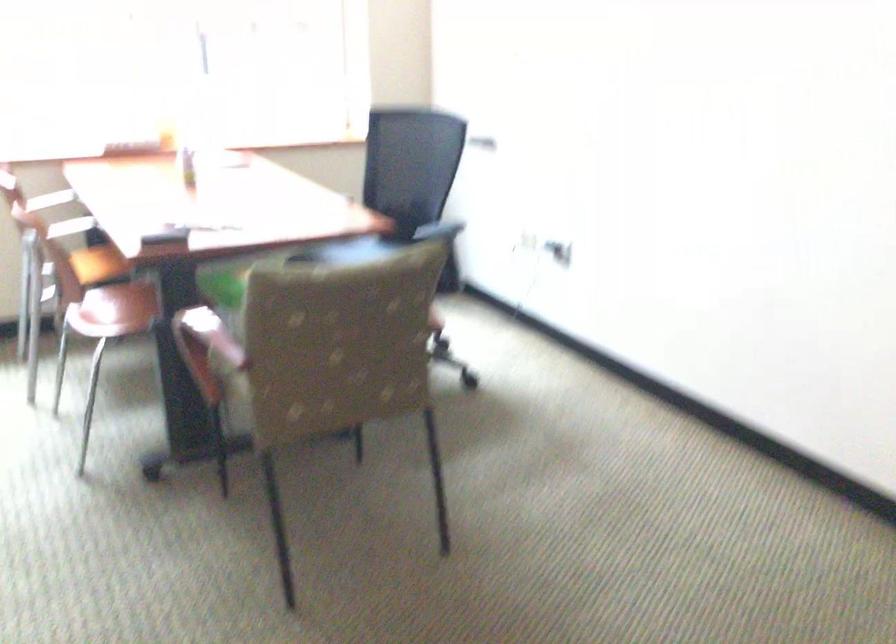
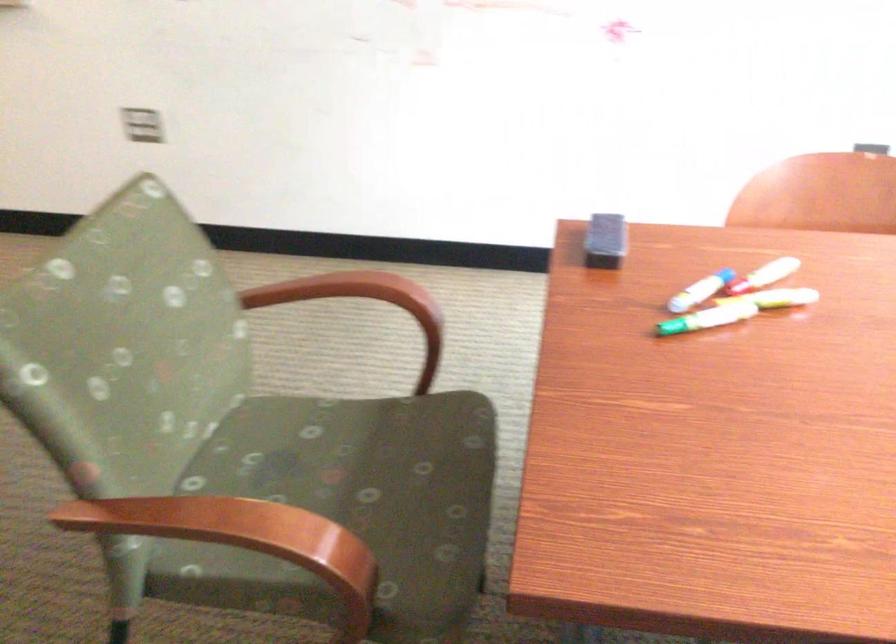
In the second image, find the point that corresponds to [194,210] in the first image.

(776, 298)